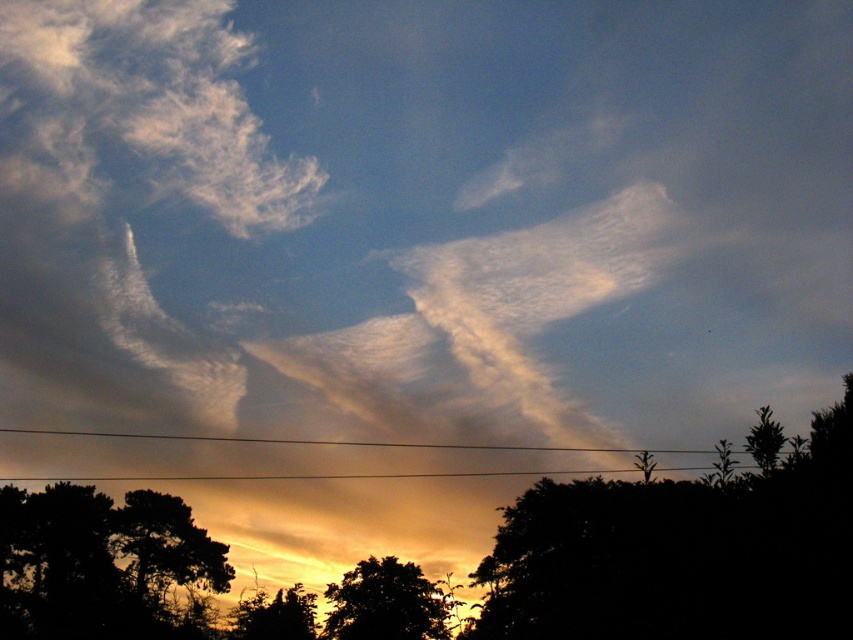
You are observing a sky scene with two points marked. The first point is at coordinates point (364,572) and the second is at point (113,477). Based on their positions, which point is nearer to you?

Point (364,572) is closer to the camera than point (113,477), so the first point is nearer to you.

You are standing in a field and see the black silhouetted tree at lower left and the silhouette leafy tree at lower center. Which tree is closer to the left edge of the field?

The black silhouetted tree at lower left is closer to the left edge of the field because it is positioned to the left of the silhouette leafy tree at lower center.

You are a bird flying in the sky scene. You see the silhouette tree at lower center and the metallic wire at bottom center. Which object is closer to you as you fly above them?

The silhouette tree at lower center is closer to you because it is further to the viewer than the metallic wire at bottom center, meaning it appears nearer in the visual perspective.